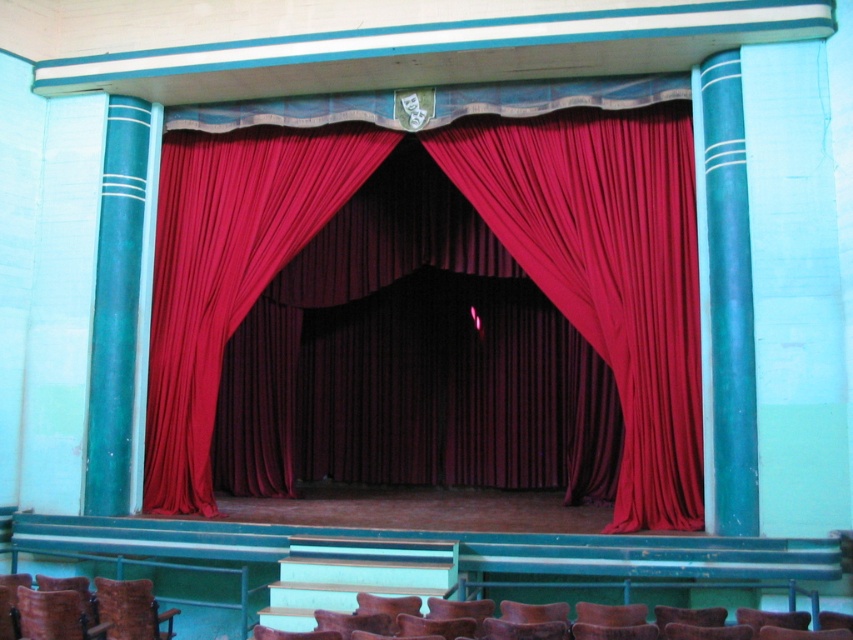
You are a GUI agent. You are given a task and a screenshot of the screen. Output one action in this format:
    pyautogui.click(x=<x>, y=<y>)
    Task: Click on the velvet red curtain at center
    The height and width of the screenshot is (640, 853).
    Given the screenshot: What is the action you would take?
    pos(607,269)

Is point (640, 449) more distant than point (136, 589)?

Yes, point (640, 449) is behind point (136, 589).

Is point (575, 184) closer to viewer compared to point (138, 596)?

No, (575, 184) is further to viewer.

This screenshot has height=640, width=853. In order to click on velvet red curtain at center in this screenshot , I will do `click(607, 269)`.